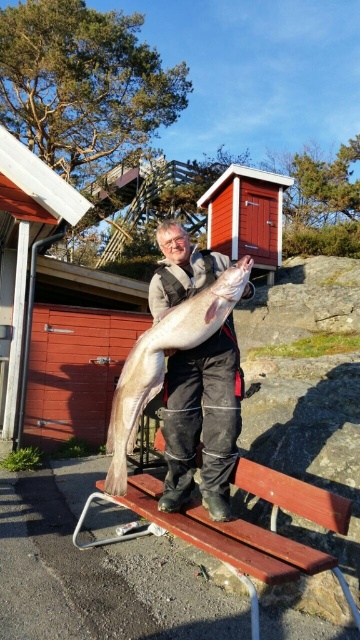
Question: Does wooden bench at center lie in front of shiny silver fish at center?

Choices:
 (A) yes
 (B) no

Answer: (A)

Question: Which of the following is the closest to the observer?

Choices:
 (A) (281, 570)
 (B) (141, 401)

Answer: (A)

Question: Is wooden bench at center further to camera compared to shiny silver fish at center?

Choices:
 (A) no
 (B) yes

Answer: (A)

Question: Can you confirm if wooden bench at center is thinner than shiny silver fish at center?

Choices:
 (A) yes
 (B) no

Answer: (B)